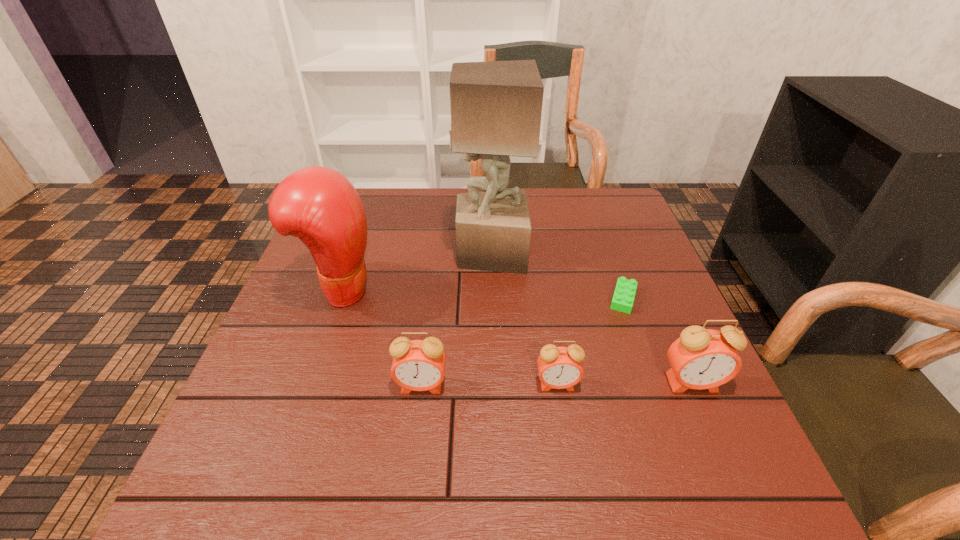
Find the location of a particular element. The height and width of the screenshot is (540, 960). vacant space at the far edge of the desktop is located at coordinates (580, 228).

This screenshot has height=540, width=960. Find the location of `vacant region at the left edge of the desktop`. vacant region at the left edge of the desktop is located at coordinates 299,392.

Identify the location of free space at the right edge of the desktop. (637, 233).

In the image, there is a desktop. Identify the location of free space at the far right corner. (580, 192).

In the image, there is a desktop. At what (x,y) coordinates should I click in order to perform the action: click on free region at the near right corner. Please return your answer as a coordinate pair (x, y). The width and height of the screenshot is (960, 540). Looking at the image, I should click on (681, 436).

The image size is (960, 540). Find the location of `vacant area between the second shortest alarm clock and the leftmost object`. vacant area between the second shortest alarm clock and the leftmost object is located at coordinates (381, 338).

Where is `free space between the second shortest alarm clock and the shortest alarm clock`? This screenshot has height=540, width=960. free space between the second shortest alarm clock and the shortest alarm clock is located at coordinates (490, 385).

Locate an element on the screen. free space between the sculpture and the shortest object is located at coordinates (557, 275).

Identify the location of free space between the shortest object and the second alarm clock from left to right. Image resolution: width=960 pixels, height=540 pixels. (590, 341).

Identify the location of vacant space that is in between the second alarm clock from left to right and the Lego. Image resolution: width=960 pixels, height=540 pixels. (590, 341).